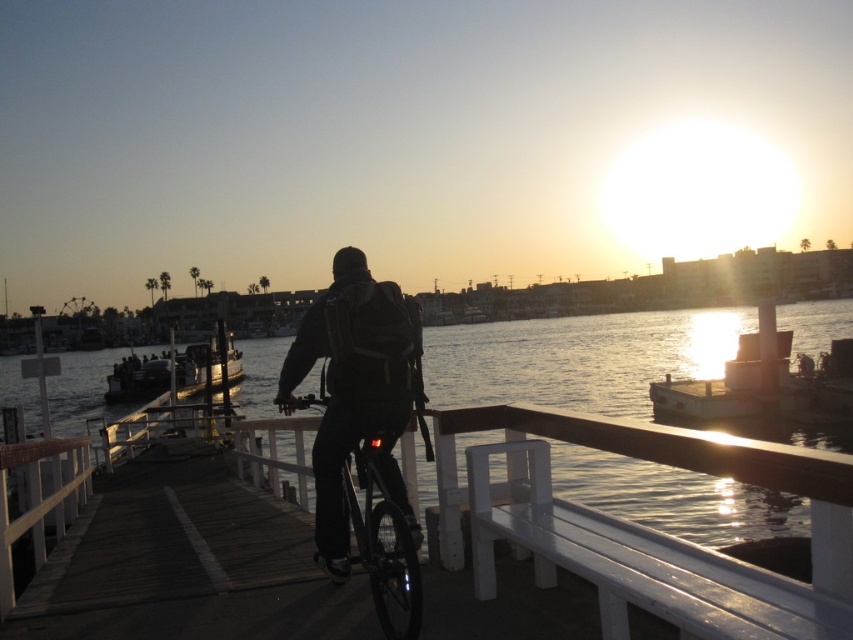
Can you confirm if black matte backpack at center is bigger than shiny black bicycle at center?

Correct, black matte backpack at center is larger in size than shiny black bicycle at center.

Who is more forward, [397,476] or [418,600]?

Point [418,600] is more forward.

The height and width of the screenshot is (640, 853). In order to click on black matte backpack at center in this screenshot , I will do `click(354, 388)`.